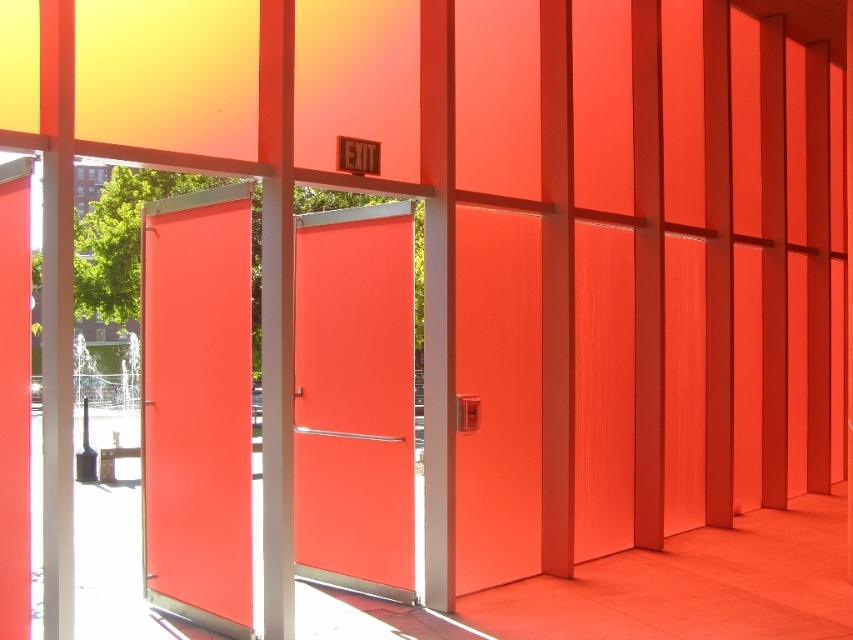
You are standing in front of the matte orange doors at center and the matte orange door at center. Which one is closer to you?

The matte orange doors at center is closer to the viewer than the matte orange door at center.

You are standing in a hallway with two doors. You need to exit through the door that is above another door. Which door should you choose between the matte orange doors at center and the satin glass door at left?

The matte orange doors at center is positioned over the satin glass door at left, so you should choose the matte orange doors at center to exit through the door that is above another door.